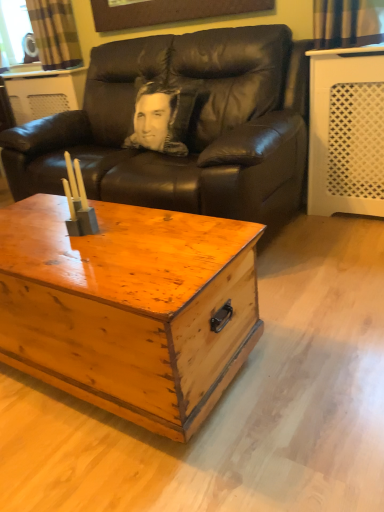
Question: Visually, is plaid fabric curtain at upper left positioned to the left or to the right of wooden chest at center?

Choices:
 (A) right
 (B) left

Answer: (B)

Question: Relative to wooden chest at center, is plaid fabric curtain at upper left in front or behind?

Choices:
 (A) front
 (B) behind

Answer: (B)

Question: Which object is the farthest from the wooden chest at center?

Choices:
 (A) plaid fabric curtain at upper left
 (B) black leather couch at center

Answer: (A)

Question: Which object is positioned closest to the black leather couch at center?

Choices:
 (A) wooden chest at center
 (B) plaid fabric curtain at upper left

Answer: (A)